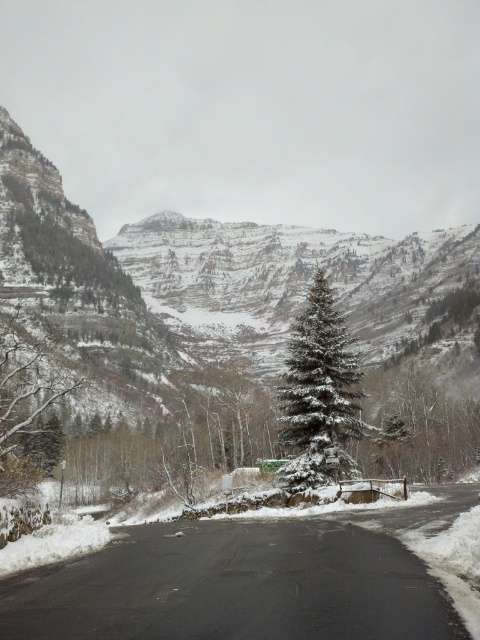
Can you confirm if black asphalt road at center is positioned above snow-covered evergreen at center?

Actually, black asphalt road at center is below snow-covered evergreen at center.

Can you confirm if black asphalt road at center is shorter than snow-covered evergreen at center?

Indeed, black asphalt road at center has a lesser height compared to snow-covered evergreen at center.

This screenshot has height=640, width=480. I want to click on black asphalt road at center, so click(233, 586).